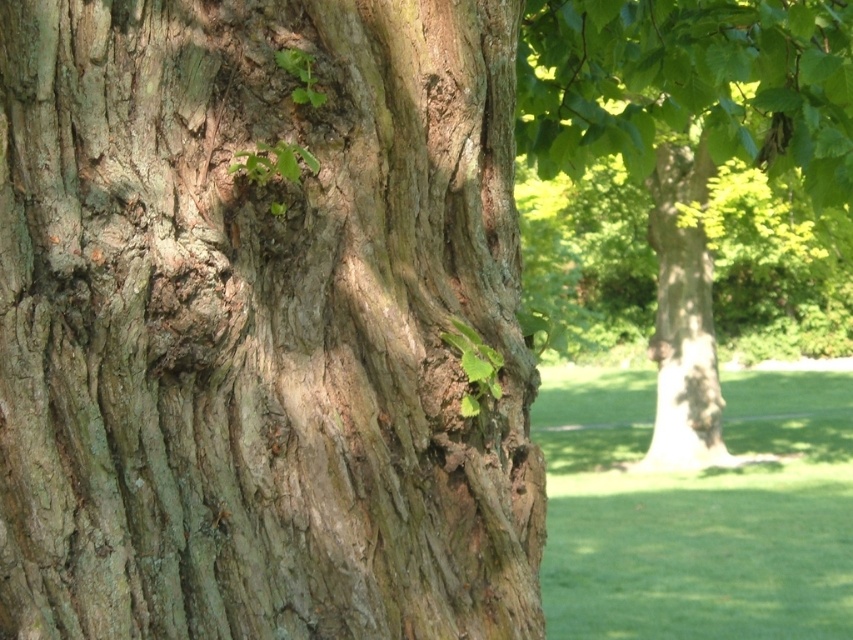
Can you confirm if greenish-brown bark at center is positioned below green leafy tree at center?

Indeed, greenish-brown bark at center is positioned under green leafy tree at center.

Between point (219, 36) and point (675, 300), which one is positioned in front?

Point (219, 36) is more forward.

What do you see at coordinates (259, 324) in the screenshot? I see `greenish-brown bark at center` at bounding box center [259, 324].

You are a GUI agent. You are given a task and a screenshot of the screen. Output one action in this format:
    pyautogui.click(x=<x>, y=<y>)
    Task: Click on the greenish-brown bark at center
    The width and height of the screenshot is (853, 640).
    Given the screenshot: What is the action you would take?
    pyautogui.click(x=259, y=324)

Looking at this image, which of these two, greenish-brown bark at center or green grass at lower right, stands taller?

Standing taller between the two is green grass at lower right.

This screenshot has width=853, height=640. Find the location of `greenish-brown bark at center`. greenish-brown bark at center is located at coordinates (259, 324).

You are a GUI agent. You are given a task and a screenshot of the screen. Output one action in this format:
    pyautogui.click(x=<x>, y=<y>)
    Task: Click on the greenish-brown bark at center
    The image size is (853, 640).
    Given the screenshot: What is the action you would take?
    pyautogui.click(x=259, y=324)

This screenshot has width=853, height=640. I want to click on green grass at lower right, so click(697, 512).

Is green grass at lower right positioned before green leafy tree at center?

That is True.

This screenshot has width=853, height=640. Describe the element at coordinates (697, 512) in the screenshot. I see `green grass at lower right` at that location.

Find the location of a particular element. This screenshot has height=640, width=853. green grass at lower right is located at coordinates (697, 512).